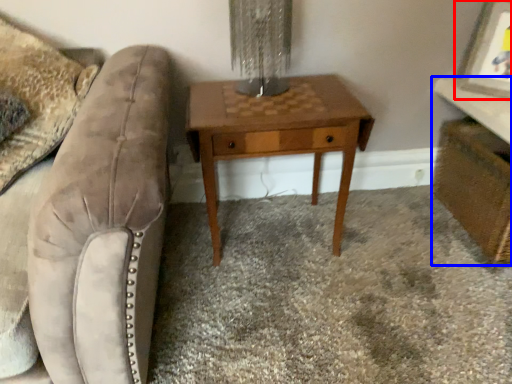
Question: Among these objects, which one is nearest to the camera, picture frame (highlighted by a red box) or vanity (highlighted by a blue box)?

Choices:
 (A) picture frame
 (B) vanity

Answer: (B)